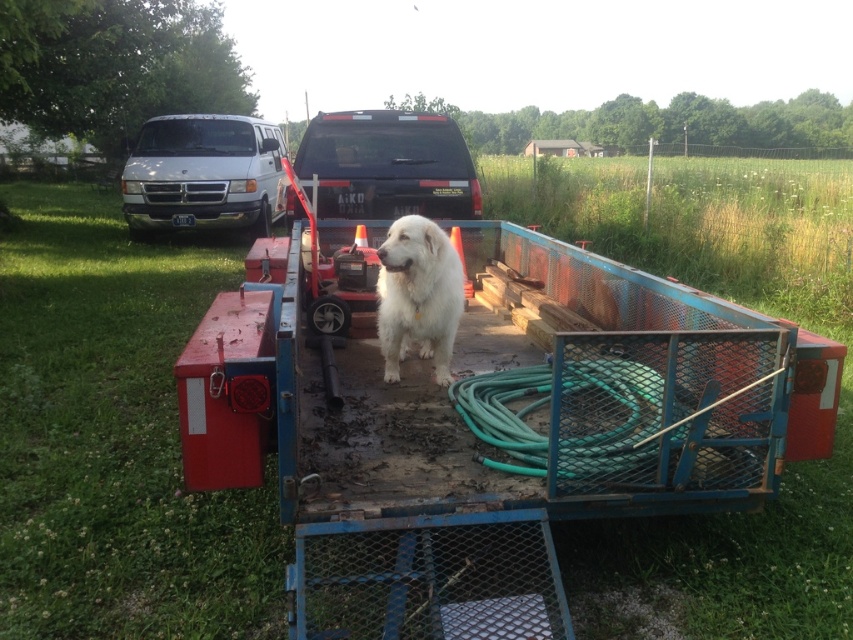
Question: Estimate the real-world distances between objects in this image. Which object is closer to the white matte van at upper left?

Choices:
 (A) green rubber garden hose at center
 (B) matte black truck at center
 (C) white fluffy dog at center

Answer: (B)

Question: Which point is farther to the camera?

Choices:
 (A) matte black truck at center
 (B) white fluffy dog at center
 (C) green rubber garden hose at center
 (D) white matte van at upper left

Answer: (D)

Question: Does matte black truck at center appear over white matte van at upper left?

Choices:
 (A) yes
 (B) no

Answer: (B)

Question: Can you confirm if matte black truck at center is smaller than green rubber garden hose at center?

Choices:
 (A) yes
 (B) no

Answer: (B)

Question: Among these points, which one is nearest to the camera?

Choices:
 (A) (328, 193)
 (B) (218, 195)

Answer: (A)

Question: Does green rubber garden hose at center come behind white fluffy dog at center?

Choices:
 (A) no
 (B) yes

Answer: (A)